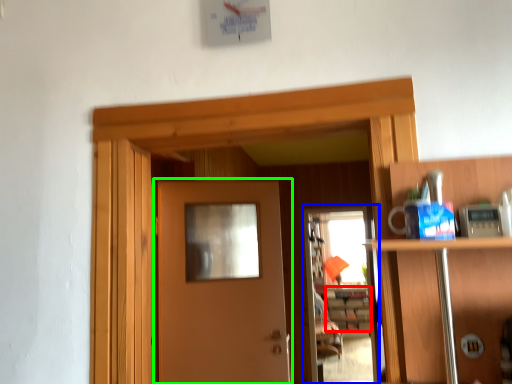
Question: Which object is positioned closest to cabinetry (highlighted by a red box)? Select from screen door (highlighted by a blue box) and door (highlighted by a green box).

Choices:
 (A) screen door
 (B) door

Answer: (A)